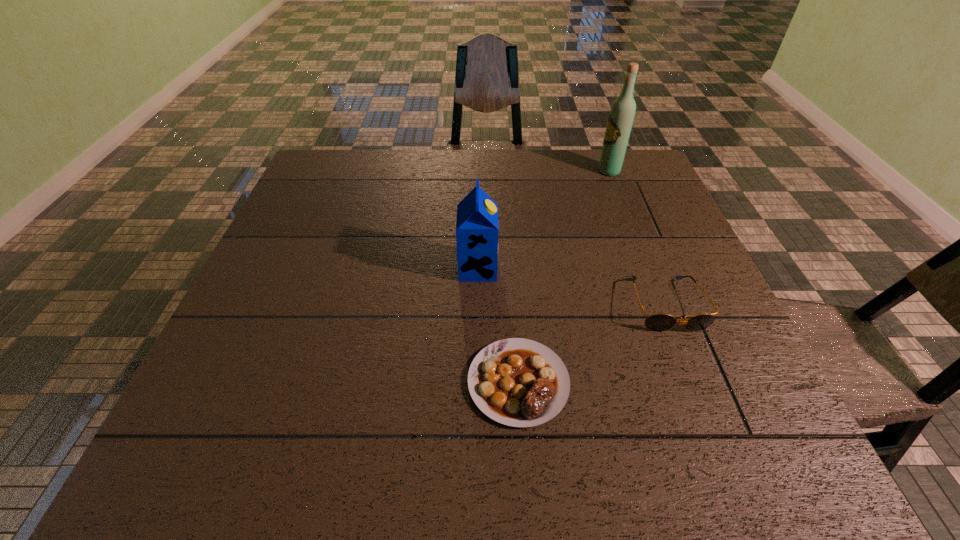
The height and width of the screenshot is (540, 960). In the image, there is a desktop. Identify the location of free region at the right edge. (684, 384).

The image size is (960, 540). I want to click on free space at the far right corner of the desktop, so click(633, 185).

Where is `blank region between the second tallest object and the sunglasses`? This screenshot has height=540, width=960. blank region between the second tallest object and the sunglasses is located at coordinates (571, 287).

The height and width of the screenshot is (540, 960). In order to click on free point between the third shortest object and the steak in this screenshot , I will do `click(498, 325)`.

The height and width of the screenshot is (540, 960). Find the location of `vacant point located between the farthest object and the nearest object`. vacant point located between the farthest object and the nearest object is located at coordinates (564, 276).

Image resolution: width=960 pixels, height=540 pixels. Identify the location of free space between the third tallest object and the carton. coord(571,287).

Identify the location of blank region between the steak and the second shortest object. (592, 343).

Find the location of a particular element. The image size is (960, 540). empty space that is in between the tallest object and the third tallest object is located at coordinates (637, 238).

Identify the location of free space between the carton and the steak. The image size is (960, 540). (498, 325).

Locate an element on the screen. empty space between the nearest object and the third shortest object is located at coordinates (498, 325).